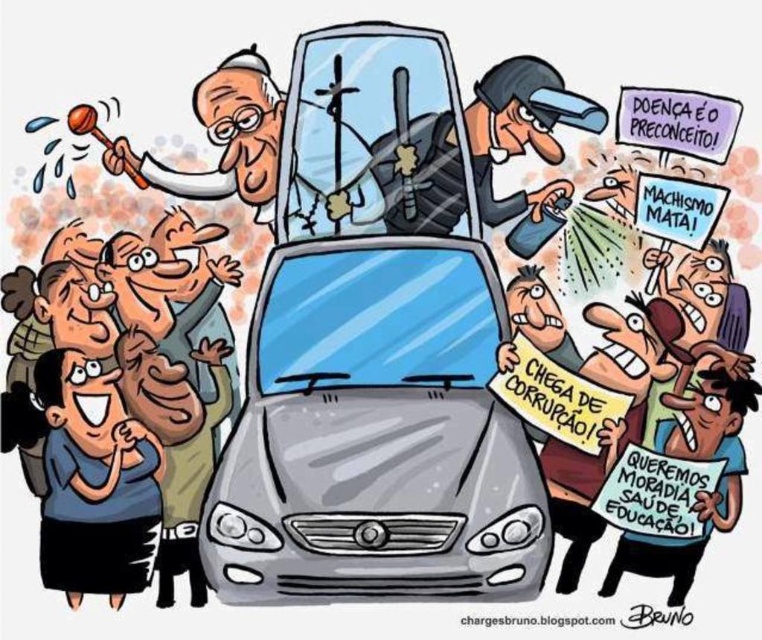
Question: Which point appears closest to the camera in this image?

Choices:
 (A) (450, 248)
 (B) (724, 396)
 (C) (559, 200)
 (D) (59, 420)

Answer: (B)

Question: Does gray metallic car at center appear on the right side of brown paper sign at lower right?

Choices:
 (A) yes
 (B) no

Answer: (B)

Question: Is gray metallic car at center to the left of blue shirt at lower left from the viewer's perspective?

Choices:
 (A) yes
 (B) no

Answer: (B)

Question: Which point appears farthest from the camera in this image?

Choices:
 (A) (551, 538)
 (B) (47, 522)

Answer: (A)

Question: Estimate the real-world distances between objects in this image. Which object is farther from the blue shirt at lower left?

Choices:
 (A) black plastic helmet at center
 (B) brown paper sign at lower right
 (C) white paper sign at center

Answer: (B)

Question: Is blue shirt at lower left to the left of brown paper sign at lower right from the viewer's perspective?

Choices:
 (A) no
 (B) yes

Answer: (B)